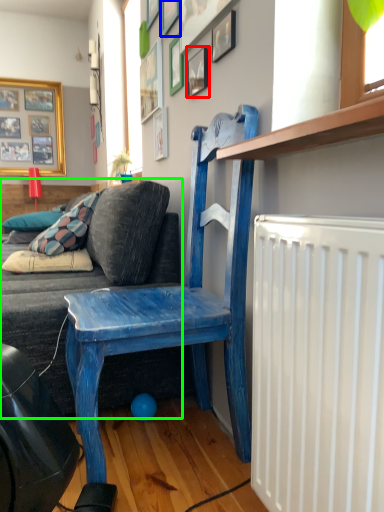
Question: Which object is positioned closest to picture frame (highlighted by a red box)? Select from picture frame (highlighted by a blue box) and studio couch (highlighted by a green box).

Choices:
 (A) picture frame
 (B) studio couch

Answer: (A)